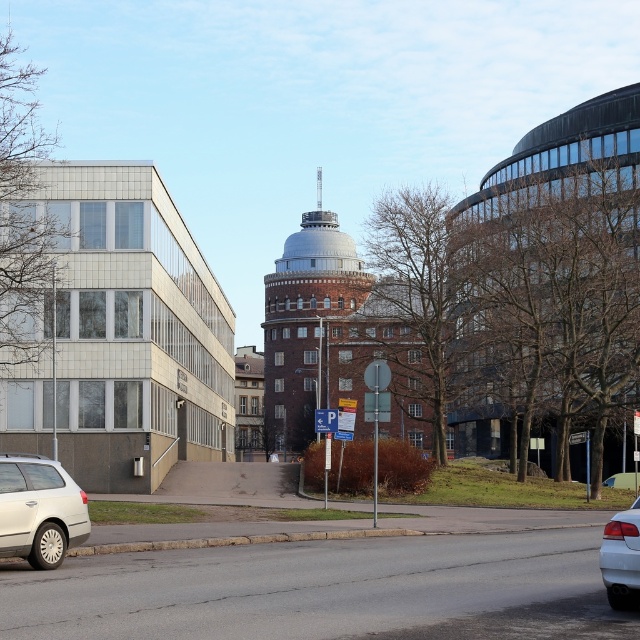
You are a delivery person who needs to deliver a package to the red brick tower at center. You are currently standing next to the silver metallic station wagon at lower left. Based on the distance between them, can you estimate whether you can walk there in under 2 minutes if your walking speed is 1.4 meters per second?

The distance between the red brick tower at center and the silver metallic station wagon at lower left is 119.02 meters. At a walking speed of 1.4 meters per second, it would take approximately 85 seconds to walk there. Since 85 seconds is more than 2 minutes, you cannot walk there in under 2 minutes.